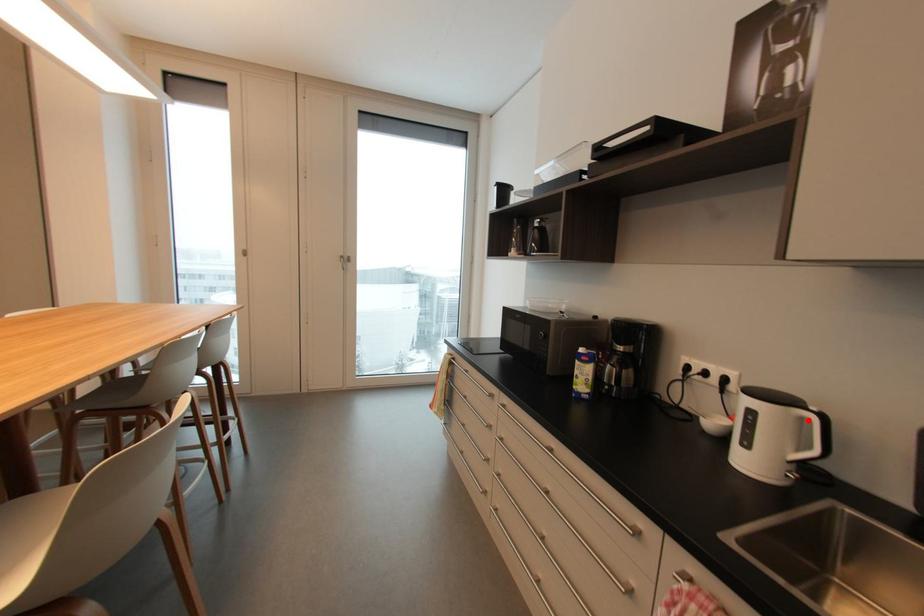
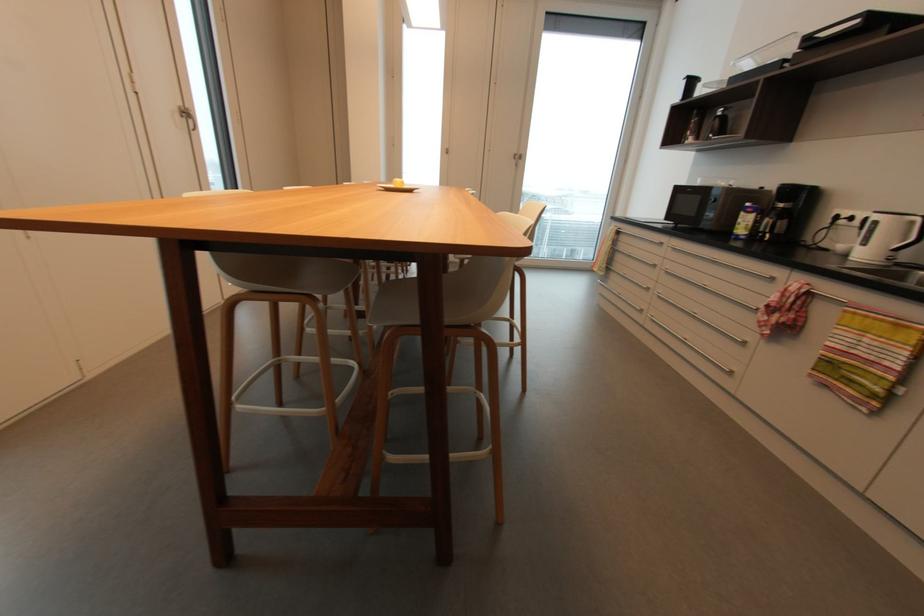
Question: I am providing you with two images of the same scene from different viewpoints. A red point is marked on the first image. Is the red point's position out of view in image 2?

Choices:
 (A) Yes
 (B) No

Answer: (B)